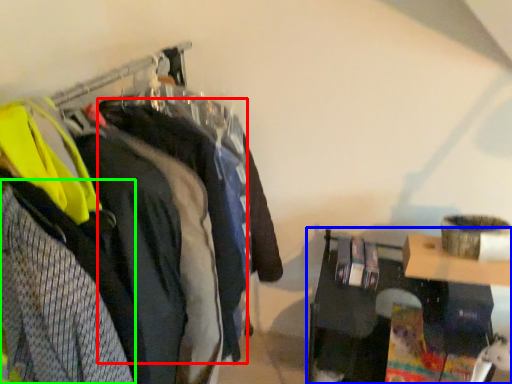
Question: Considering the real-world distances, which object is closest to clothing (highlighted by a red box)? furniture (highlighted by a blue box) or clothing (highlighted by a green box).

Choices:
 (A) furniture
 (B) clothing

Answer: (B)